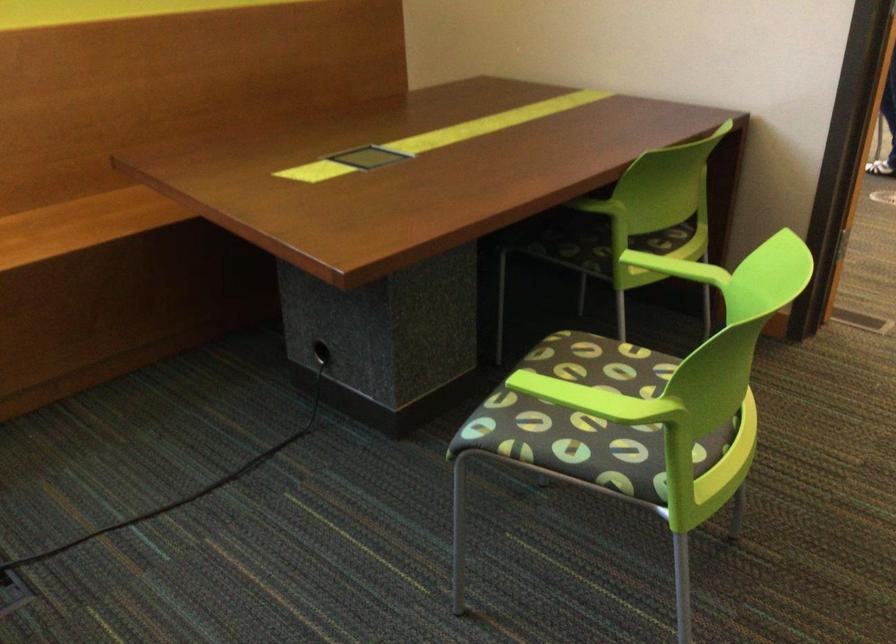
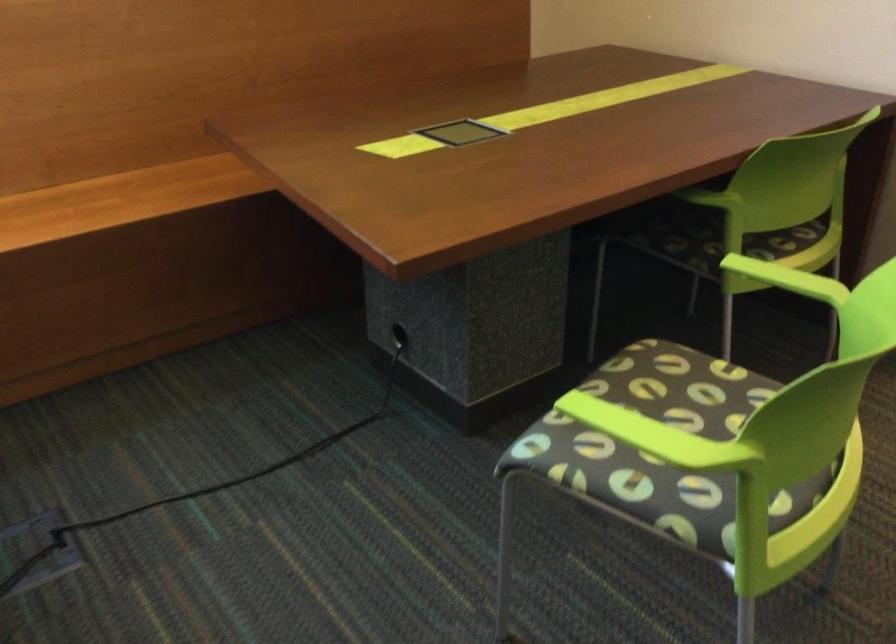
Question: Based on the continuous images, in which direction is the camera rotating? Reply with the corresponding letter.

Choices:
 (A) Left
 (B) Right
 (C) Up
 (D) Down

Answer: (A)